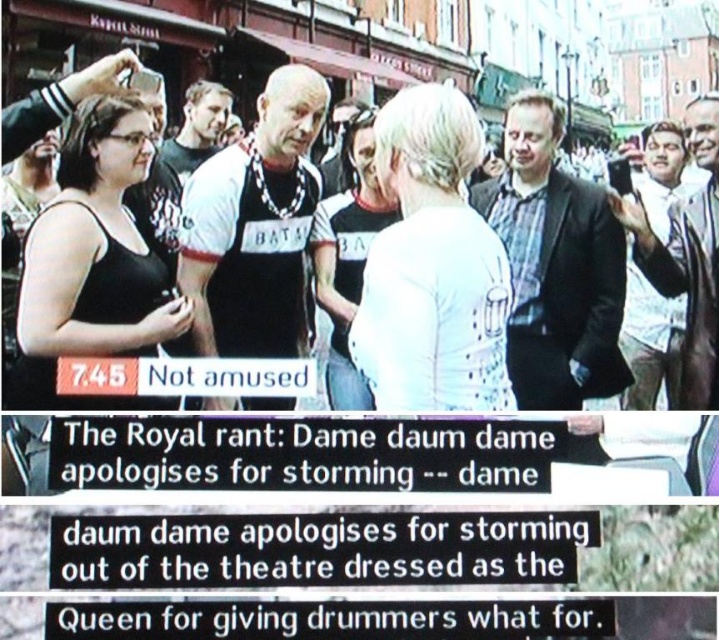
Question: Which object appears farthest from the camera in this image?

Choices:
 (A) black matte tank top at left
 (B) black fabric crowd at center

Answer: (B)

Question: Among these objects, which one is nearest to the camera?

Choices:
 (A) white matte shirt at center
 (B) black fabric crowd at center
 (C) black matte tank top at left

Answer: (C)

Question: Does white matte shirt at center appear under black fabric crowd at center?

Choices:
 (A) no
 (B) yes

Answer: (B)

Question: Which of the following is the farthest from the observer?

Choices:
 (A) (526, 164)
 (B) (86, 262)

Answer: (A)

Question: Does white matte shirt at center lie behind black matte tank top at left?

Choices:
 (A) yes
 (B) no

Answer: (A)

Question: Observing the image, what is the correct spatial positioning of black matte tank top at left in reference to black fabric crowd at center?

Choices:
 (A) above
 (B) below

Answer: (B)